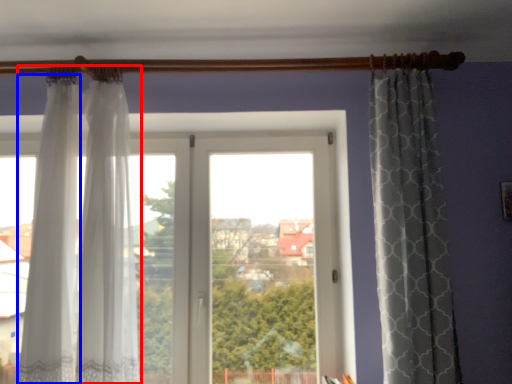
Question: Which point is further to the camera, curtain (highlighted by a red box) or curtain (highlighted by a blue box)?

Choices:
 (A) curtain
 (B) curtain

Answer: (A)